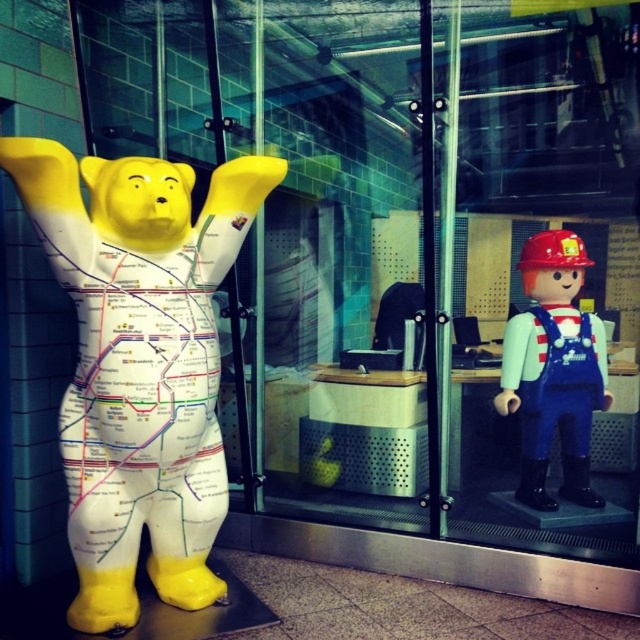
You are standing in front of a glass door and see the yellow matte bear at left and the matte blue overalls at right. Which object is larger in size?

The yellow matte bear at left is bigger than the matte blue overalls at right.

You are standing in front of a glass door at a transportation hub. You see a yellow matte bear at left and a matte blue overalls at right. Which object is positioned more to the left side?

The yellow matte bear at left is positioned more to the left side than the matte blue overalls at right.

You are standing at the glass door and see a yellow matte bear at left and a point at coordinates (140, 362). Which object is closer to you?

The point at coordinates (140, 362) is closer to you because it corresponds to the yellow matte bear at left, which is positioned at the left side of the glass door.